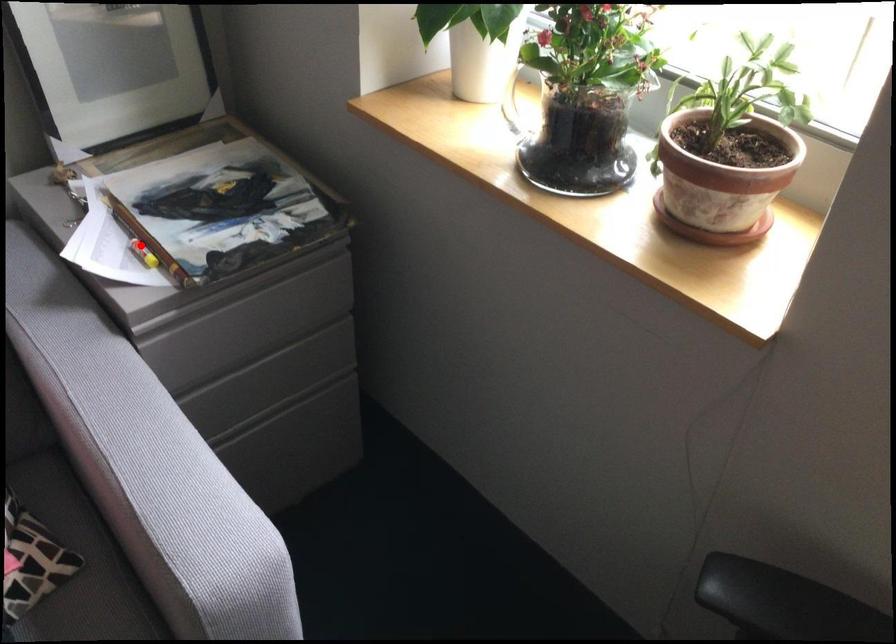
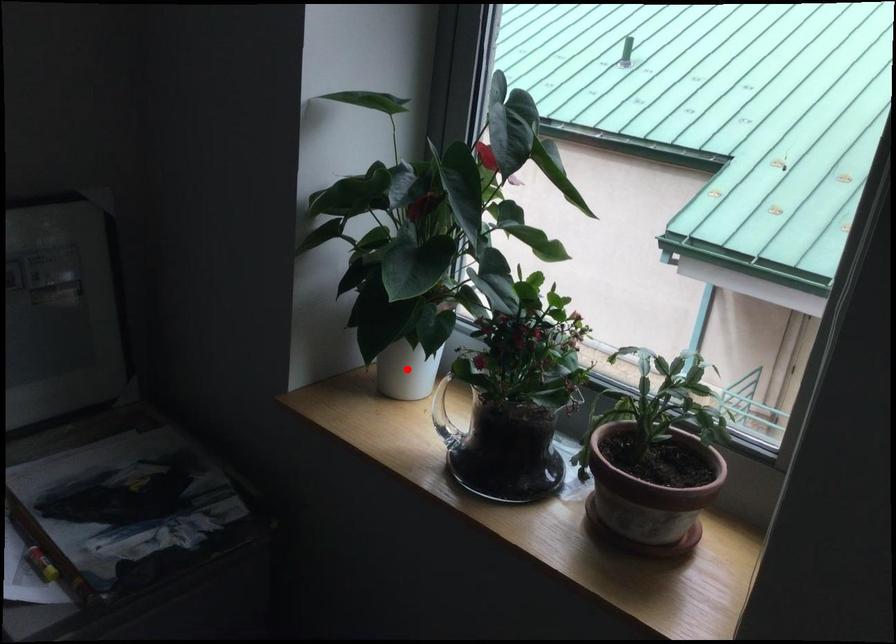
I am providing you with two images of the same scene from different viewpoints. A red point is marked on the first image and another point is marked on the second image. Do the highlighted points in image1 and image2 indicate the same real-world spot?

No